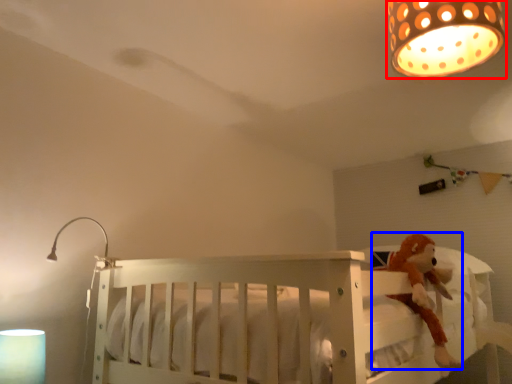
Question: Among these objects, which one is nearest to the camera, lamp (highlighted by a red box) or toy (highlighted by a blue box)?

Choices:
 (A) lamp
 (B) toy

Answer: (A)